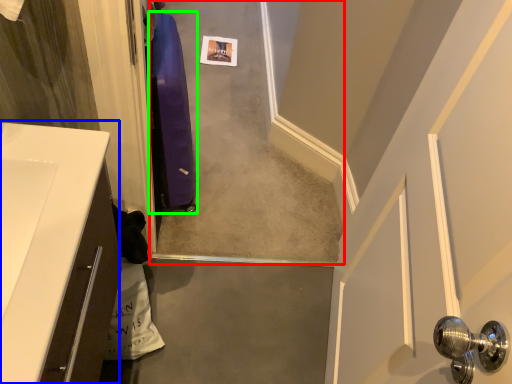
Question: Estimate the real-world distances between objects in this image. Which object is closer to concrete (highlighted by a red box), counter top (highlighted by a blue box) or luggage (highlighted by a green box)?

Choices:
 (A) counter top
 (B) luggage

Answer: (B)